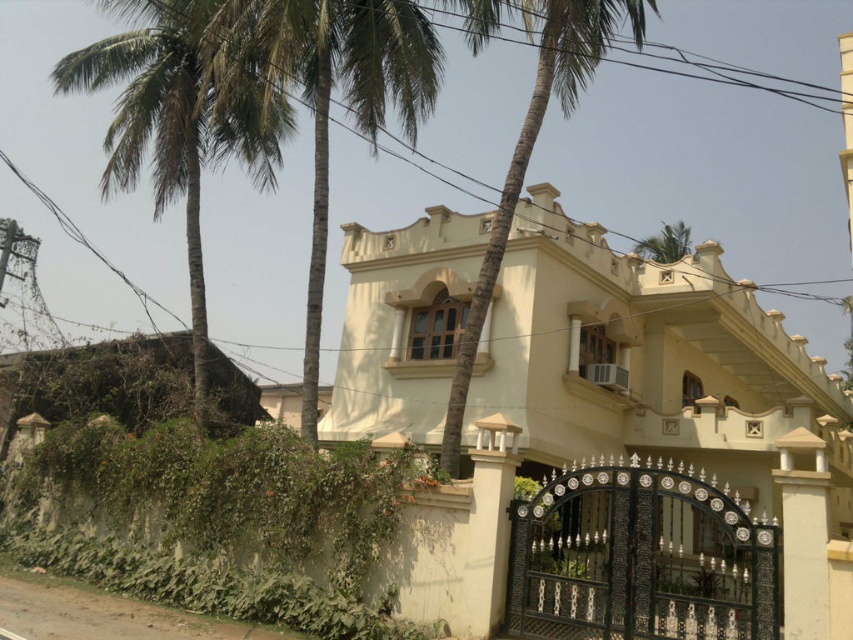
You are standing in front of the residential building and notice a point marked at coordinates (x=344, y=97). Based on the scene description, what object is located at that point?

The point at coordinates (x=344, y=97) corresponds to the green leafy palm tree at upper left.